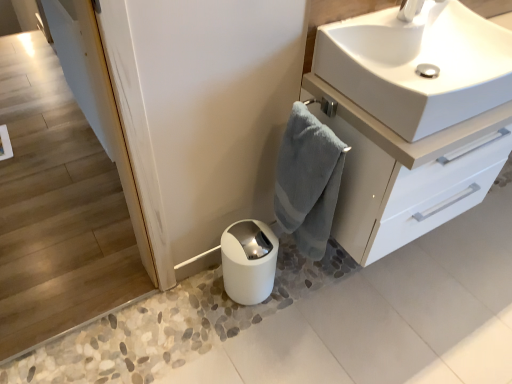
Question: From the image's perspective, relative to white glossy sink at upper right, is white glossy toilet paper at lower center above or below?

Choices:
 (A) below
 (B) above

Answer: (A)

Question: Is white glossy toilet paper at lower center inside the boundaries of white glossy sink at upper right, or outside?

Choices:
 (A) inside
 (B) outside

Answer: (B)

Question: Which object is positioned farthest from the white glossy sink at upper right?

Choices:
 (A) white glossy toilet paper at lower center
 (B) gray cotton towel at center-right
 (C) white glossy cabinet at upper right

Answer: (A)

Question: Estimate the real-world distances between objects in this image. Which object is farther from the gray cotton towel at center-right?

Choices:
 (A) white glossy cabinet at upper right
 (B) white glossy toilet paper at lower center
 (C) white glossy sink at upper right

Answer: (C)